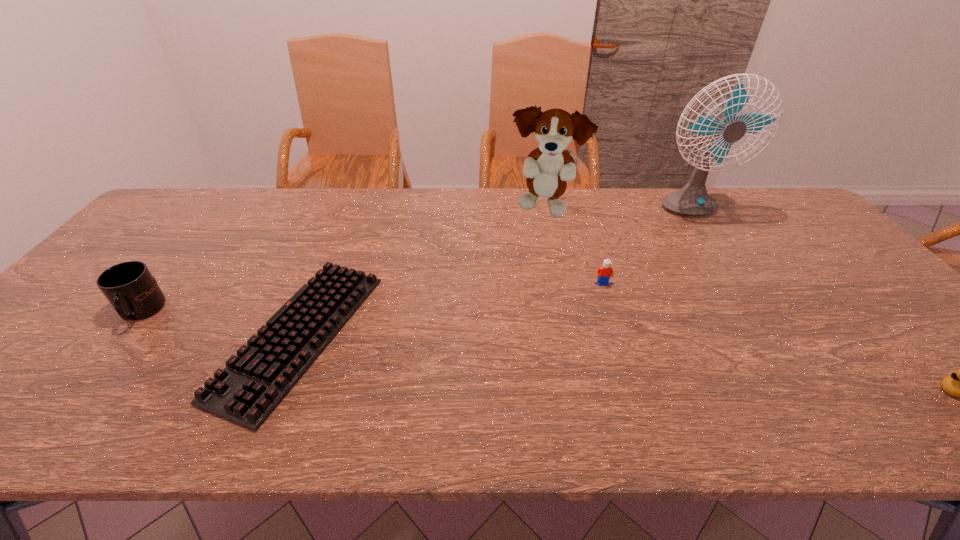
I want to click on the tallest object, so click(x=693, y=200).

At what (x,y) coordinates should I click in order to perform the action: click on fan. Please return your answer as a coordinate pair (x, y). The image size is (960, 540). Looking at the image, I should click on (693, 200).

Locate an element on the screen. The height and width of the screenshot is (540, 960). puppy is located at coordinates (547, 168).

Where is `the leftmost object`? the leftmost object is located at coordinates (131, 289).

Where is `mug`? The height and width of the screenshot is (540, 960). mug is located at coordinates (131, 289).

Find the location of `Lego`. Lego is located at coordinates (605, 271).

Identify the location of computer keyboard. (253, 383).

Find the location of `the second object from left to right`. the second object from left to right is located at coordinates (253, 383).

You are a GUI agent. You are given a task and a screenshot of the screen. Output one action in this format:
    pyautogui.click(x=<x>, y=<y>)
    Task: Click on the vacant region located 0.300m on the front-facing side of the tallest object
    The image size is (960, 540).
    Given the screenshot: What is the action you would take?
    [x=741, y=292]

I want to click on vacant space located on the face of the fifth shortest object, so click(x=552, y=247).